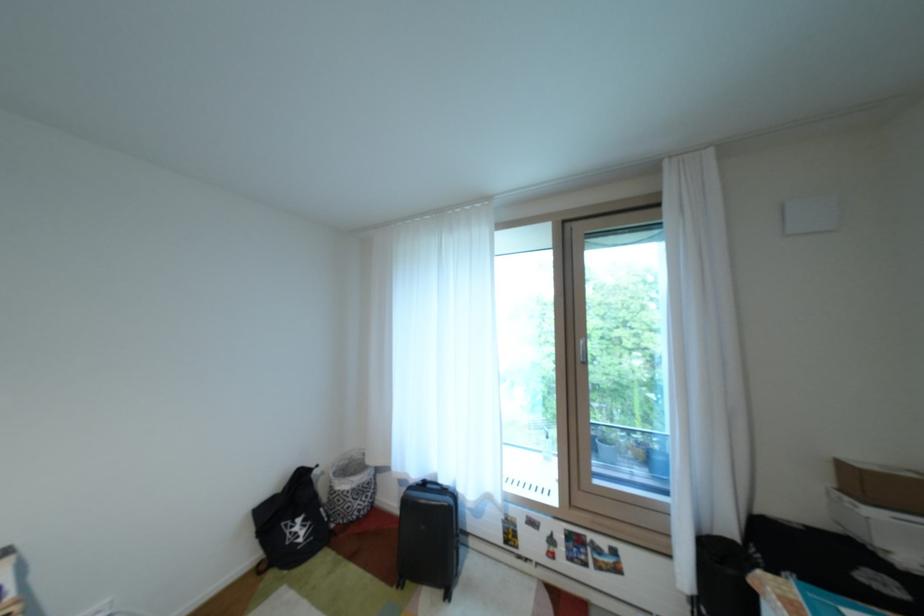
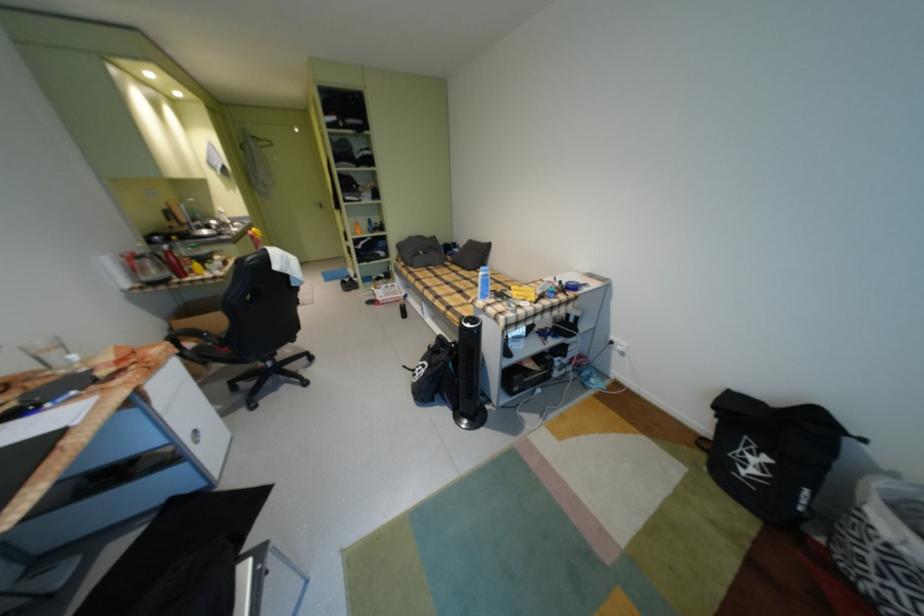
Where in the second image is the point corresponding to (353,493) from the first image?

(882, 529)